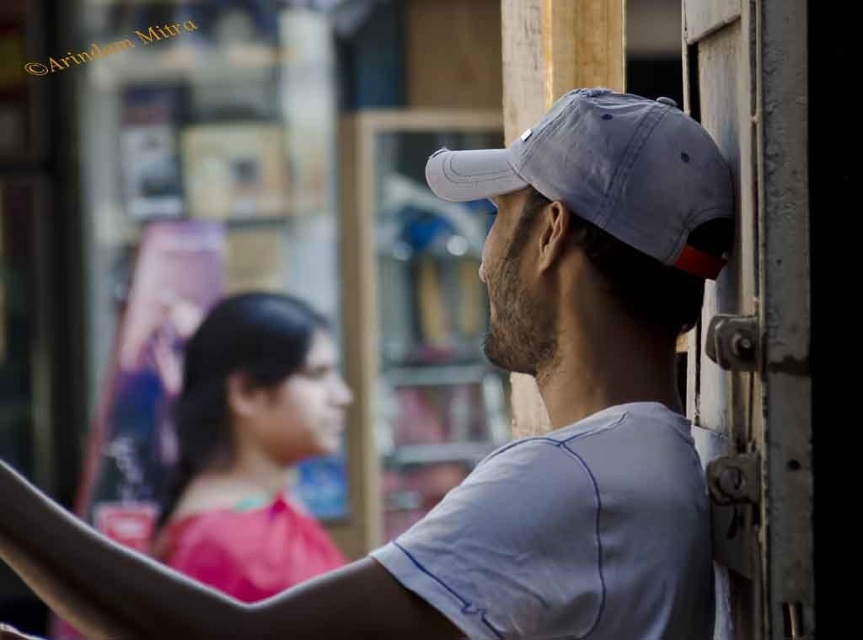
Question: Which object appears farthest from the camera in this image?

Choices:
 (A) gray cotton baseball cap at upper right
 (B) gray fabric cap at upper right

Answer: (A)

Question: Which point is farther from the camera taking this photo?

Choices:
 (A) (685, 492)
 (B) (479, 166)

Answer: (B)

Question: Can you confirm if gray fabric cap at upper right is smaller than gray cotton baseball cap at upper right?

Choices:
 (A) no
 (B) yes

Answer: (A)

Question: From the image, what is the correct spatial relationship of gray fabric cap at upper right in relation to gray cotton baseball cap at upper right?

Choices:
 (A) above
 (B) below

Answer: (B)

Question: Can you confirm if gray fabric cap at upper right is positioned to the right of gray cotton baseball cap at upper right?

Choices:
 (A) yes
 (B) no

Answer: (B)

Question: Which of the following is the farthest from the observer?

Choices:
 (A) (652, 394)
 (B) (628, 237)

Answer: (A)